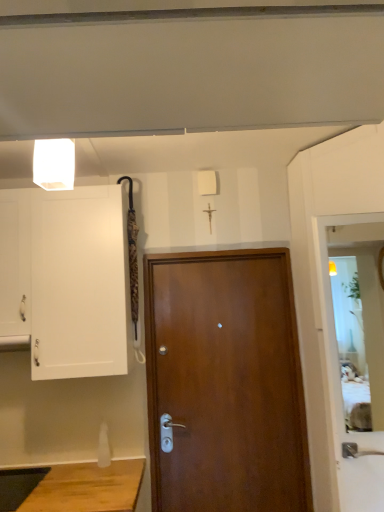
This screenshot has height=512, width=384. What do you see at coordinates (225, 382) in the screenshot? I see `wooden door at center` at bounding box center [225, 382].

Image resolution: width=384 pixels, height=512 pixels. I want to click on wooden door at center, so click(225, 382).

In the scene shown: Measure the distance between point (151, 417) and camera.

The depth of point (151, 417) is 7.74 feet.

Where is `wooden door at center`? wooden door at center is located at coordinates (225, 382).